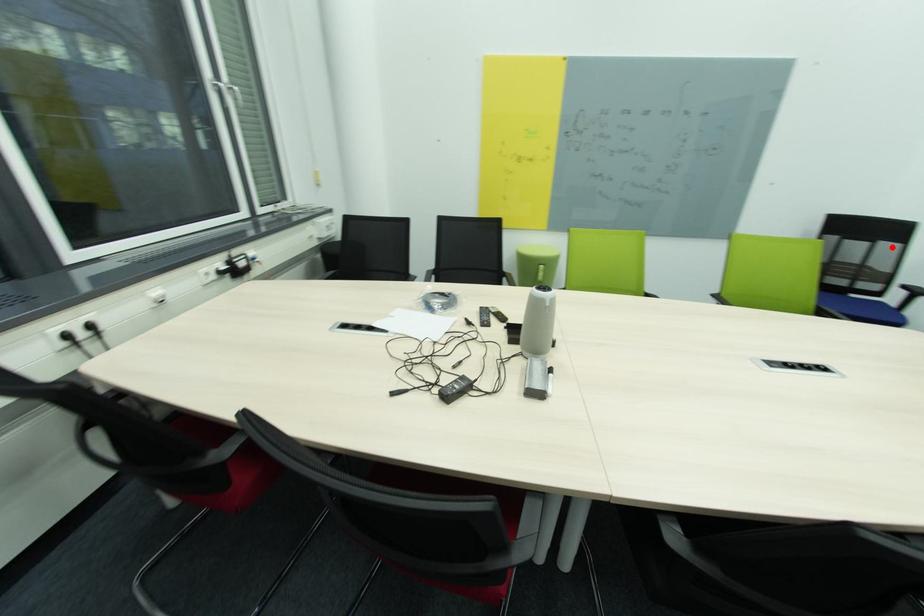
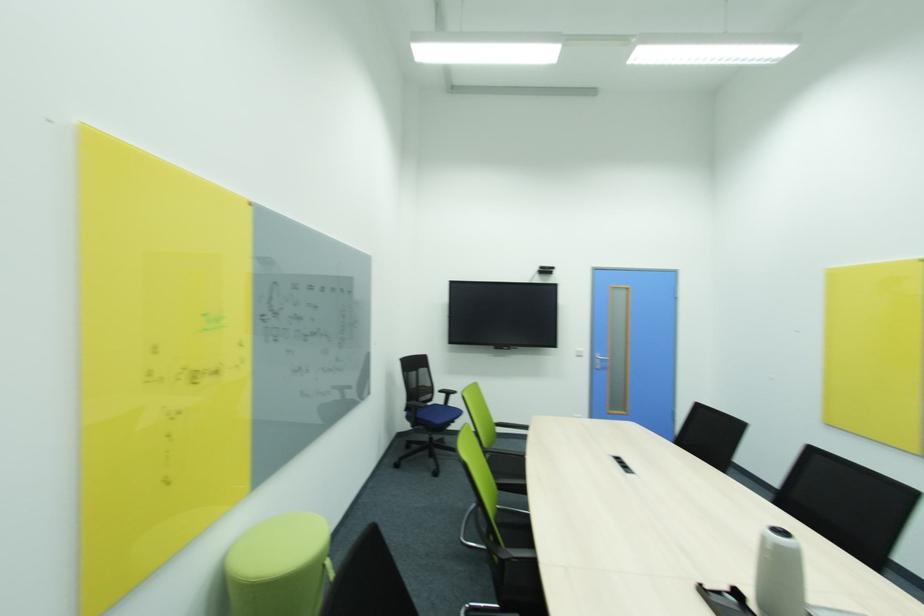
Where in the second image is the point corresponding to the highlighted location from the first image?

(428, 371)